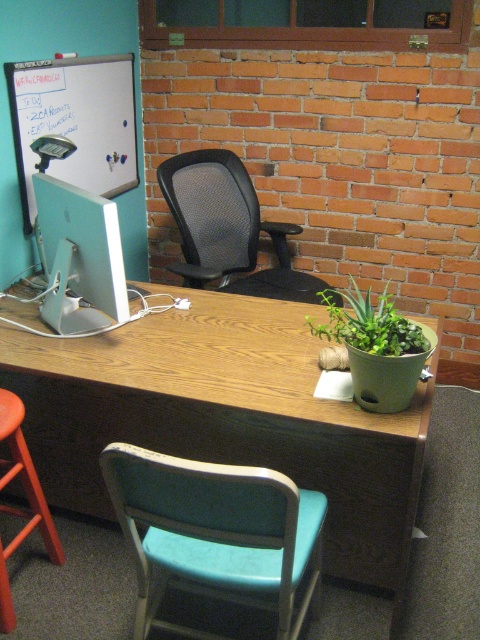
Based on the photo, can you confirm if teal fabric chair at lower center is taller than white glossy computer monitor at left?

Yes, teal fabric chair at lower center is taller than white glossy computer monitor at left.

Between point (148, 579) and point (116, 250), which one is positioned in front?

Point (148, 579) is in front.

Is point (168, 538) in front of point (113, 268)?

Yes.

Locate an element on the screen. This screenshot has height=640, width=480. teal fabric chair at lower center is located at coordinates coord(216,534).

Does wooden desk at center have a smaller size compared to wooden bar stool at lower left?

No.

Locate an element on the screen. wooden desk at center is located at coordinates (227, 419).

Locate an element on the screen. Image resolution: width=480 pixels, height=640 pixels. wooden desk at center is located at coordinates (227, 419).

Which is behind, point (315, 560) or point (134, 140)?

Point (134, 140)

Is teal fabric chair at lower center wider than whiteboard at upper left?

Yes, teal fabric chair at lower center is wider than whiteboard at upper left.

Is point (109, 481) positioned before point (57, 160)?

That is True.

Where is `teal fabric chair at lower center`? This screenshot has width=480, height=640. teal fabric chair at lower center is located at coordinates (216, 534).